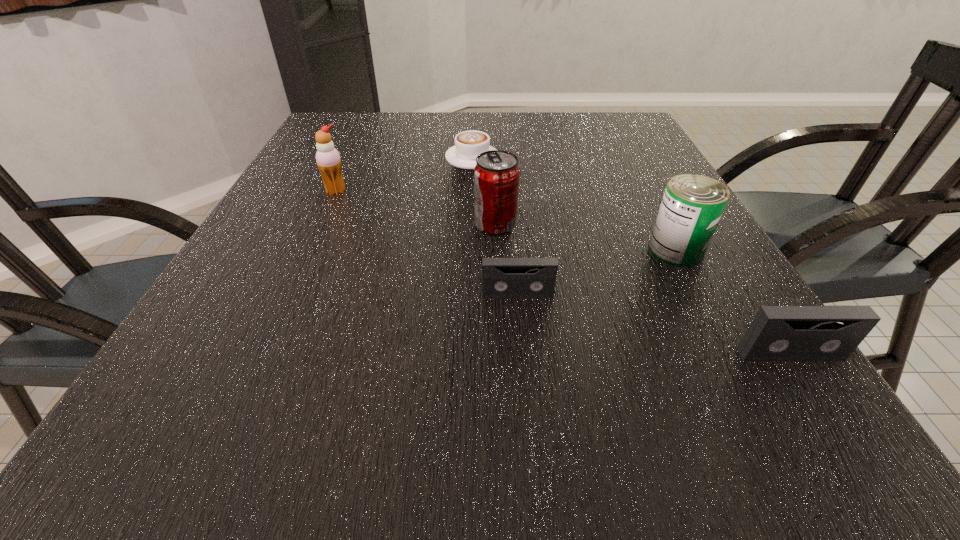
In the current image, all videotapes are evenly spaced. To maintain this equal spacing, where should an additional videotape be placed on the left? Please point out a free spot. Please provide its 2D coordinates. Your answer should be formatted as a tuple, i.e. [(x, y)], where the tuple contains the x and y coordinates of a point satisfying the conditions above.

[(306, 248)]